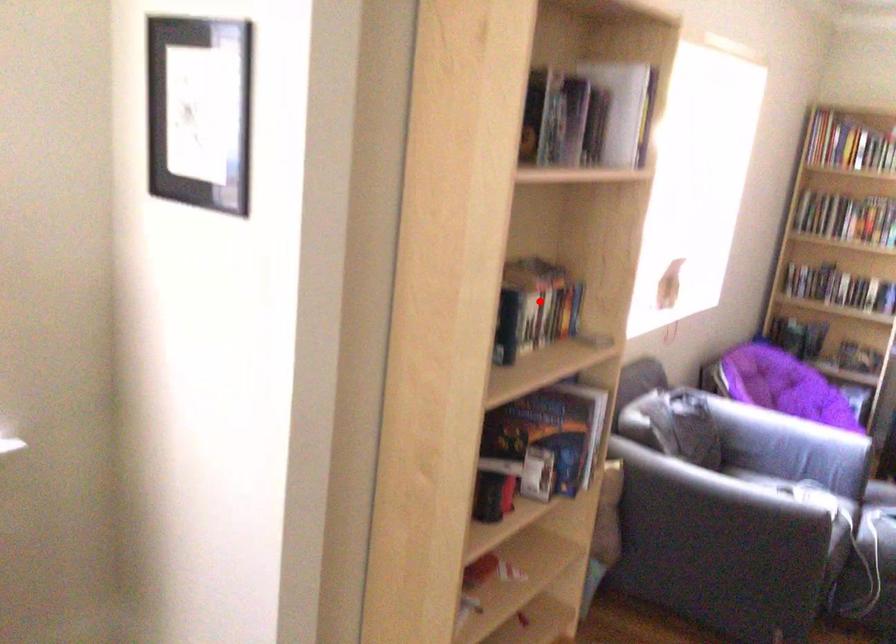
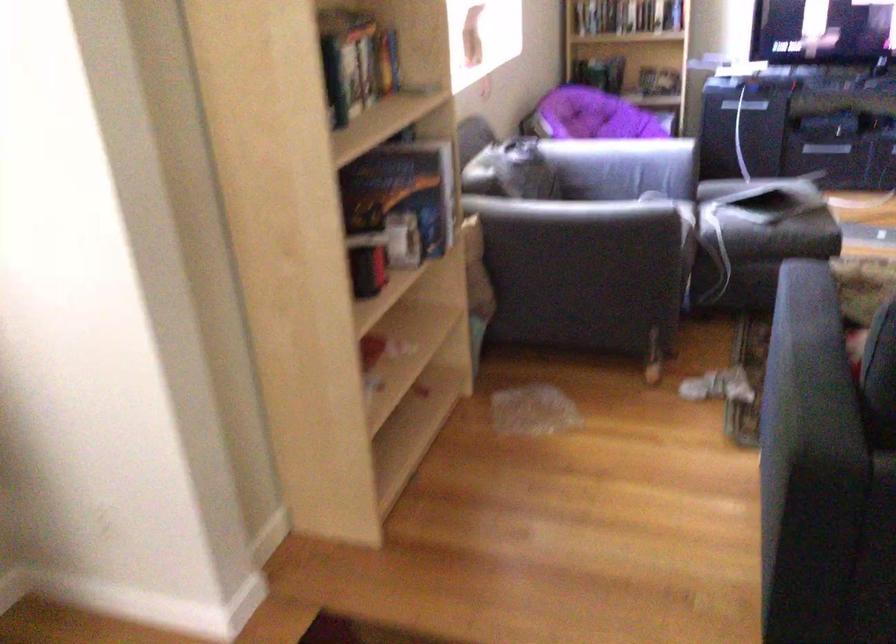
In the second image, find the point that corresponds to the highlighted location in the first image.

(358, 57)